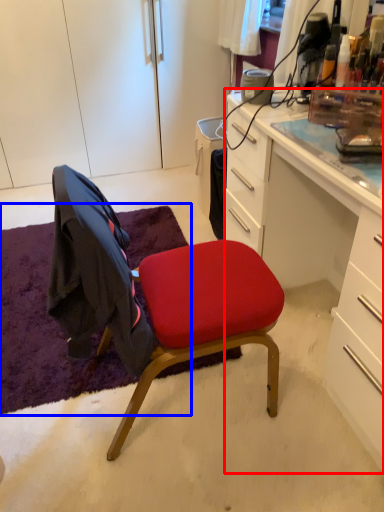
Question: Which object is closer to the camera taking this photo, desk (highlighted by a red box) or mat (highlighted by a blue box)?

Choices:
 (A) desk
 (B) mat

Answer: (A)